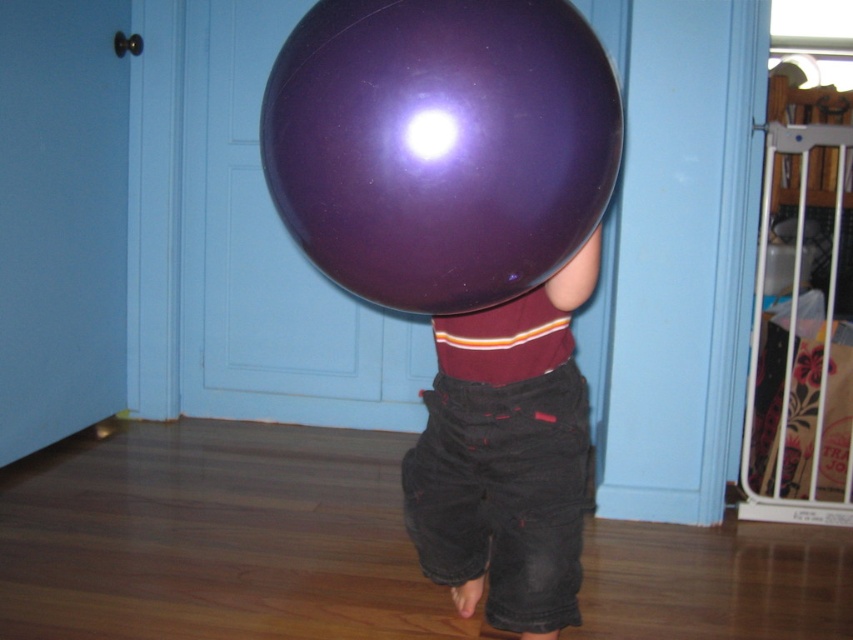
You are a parent trying to take a photo of your child. The shiny purple balloon at center and denim shorts at center are both in the frame. Which object should you move closer to ensure the balloon is the main focus?

To make the shiny purple balloon at center the main focus, you should move the denim shorts at center closer to the camera since the balloon is smaller than the shorts. This will help the balloon appear larger in the photo.

You are a parent holding a 24 inch wide box. You want to hand it to your child who is standing behind the shiny purple balloon at center. Can you safely pass the box without hitting the balloon?

The shiny purple balloon at center and viewer are 29.08 inches apart from each other. Since the box is 24 inches wide, which is smaller than the distance between you and the balloon, you can safely pass the box without hitting the balloon.